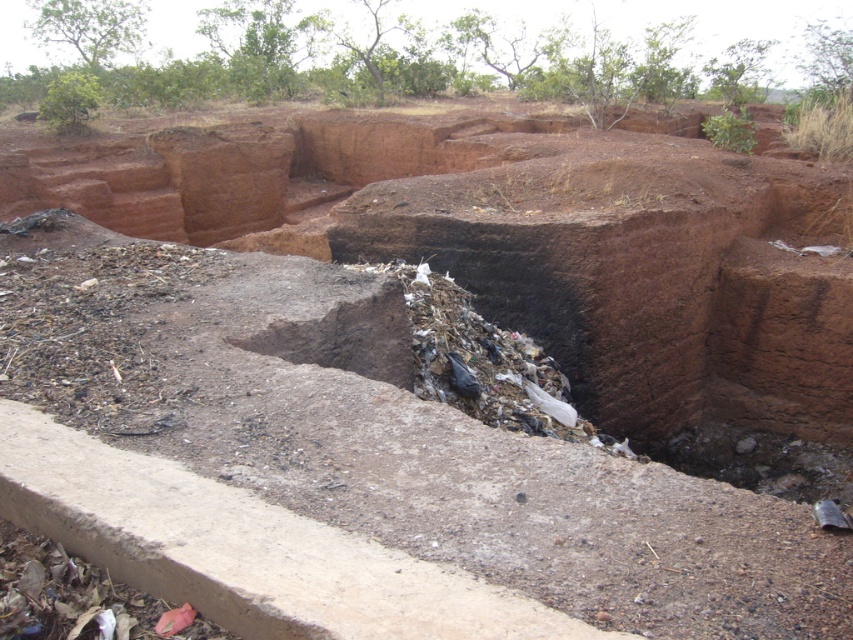
What do you see at coordinates (486, 364) in the screenshot? This screenshot has height=640, width=853. I see `black plastic bags at center` at bounding box center [486, 364].

Locate an element on the screen. The image size is (853, 640). black plastic bags at center is located at coordinates (486, 364).